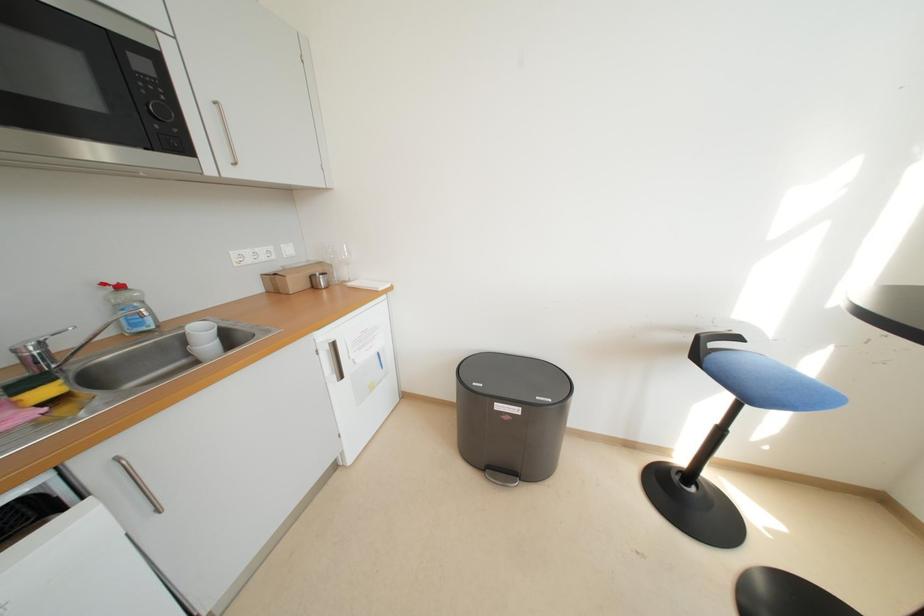
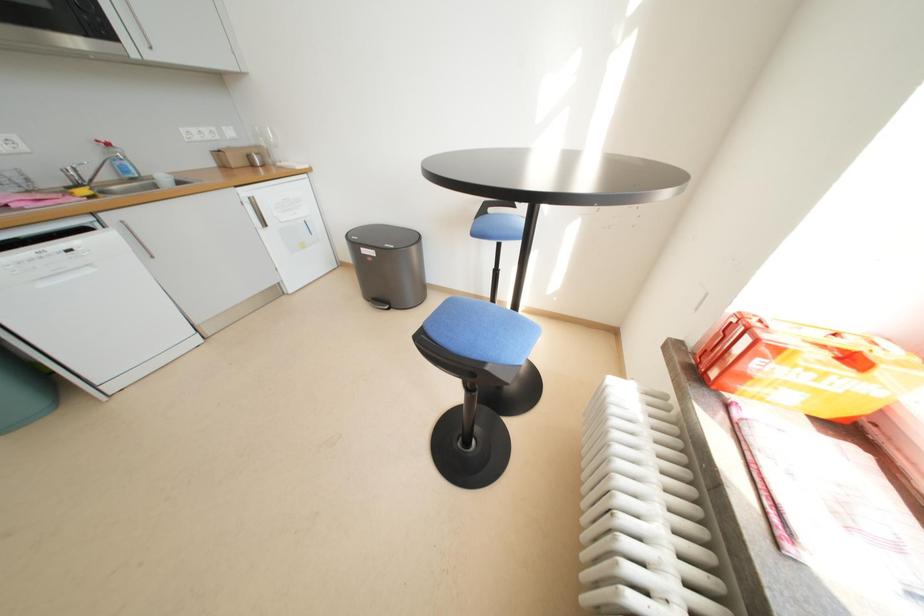
Consider the image. Which direction would the cameraman need to move to produce the second image?

The cameraman moved toward right, backward.